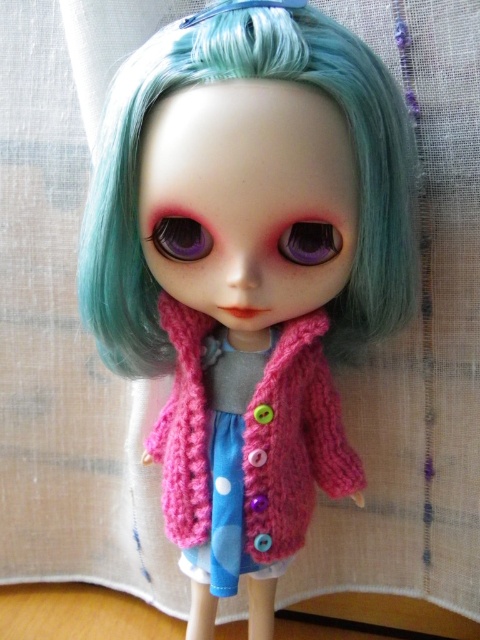
Consider the image. You are a fashion designer looking at the doll. You need to determine the arrangement of the pink knitted cardigan at center and the pink knitted dress at center. Which one is on the right side?

The pink knitted cardigan at center is positioned on the right side of the pink knitted dress at center, so the cardigan is on the right.

You are a photographer adjusting the camera focus. You need to focus on both the point at point (275, 387) and the point at point (240, 497). Which point should you focus on first to ensure the closest object is sharp?

Point (275, 387) is in front of point (240, 497), so you should focus on point (275, 387) first to ensure the closest object is sharp.